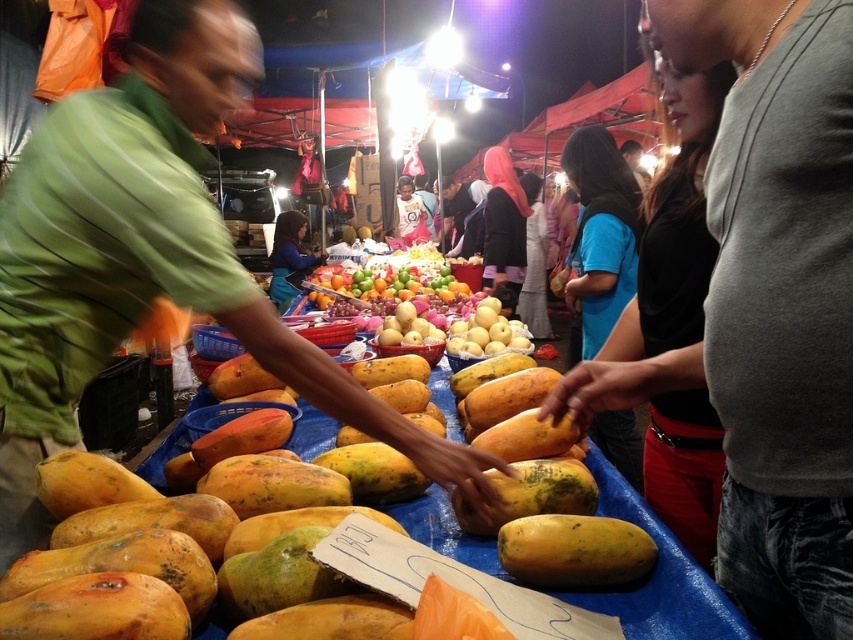
Question: Among these objects, which one is nearest to the camera?

Choices:
 (A) green matte shirt at center
 (B) gray cotton shirt at center

Answer: (B)

Question: Does gray cotton shirt at center have a lesser width compared to yellow smooth mangoes at center?

Choices:
 (A) no
 (B) yes

Answer: (B)

Question: Which point is closer to the camera?

Choices:
 (A) glossy plastic fruits at center
 (B) blue fabric apron at center
 (C) yellow papaya at center
 (D) gray cotton shirt at center

Answer: (D)

Question: Estimate the real-world distances between objects in this image. Which object is closer to the green matte shirt at center?

Choices:
 (A) yellow matte papaya at center
 (B) blue fabric apron at center
 (C) glossy plastic fruits at center

Answer: (A)

Question: Does gray cotton shirt at center have a greater width compared to green matte shirt at center?

Choices:
 (A) no
 (B) yes

Answer: (A)

Question: Does yellow papaya at center appear over blue fabric apron at center?

Choices:
 (A) no
 (B) yes

Answer: (A)